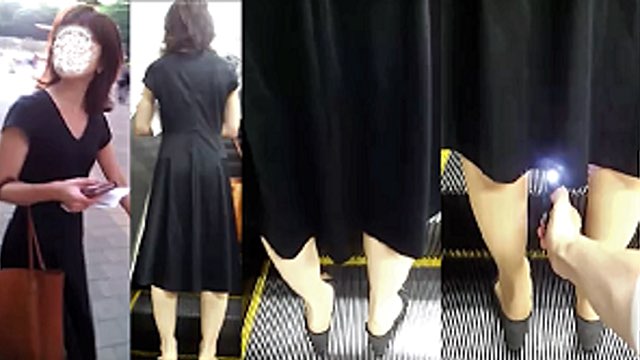
At what (x,y) coordinates should I click in order to perform the action: click on phone. Please return your answer as a coordinate pair (x, y). The image size is (640, 360). Looking at the image, I should click on (95, 190).